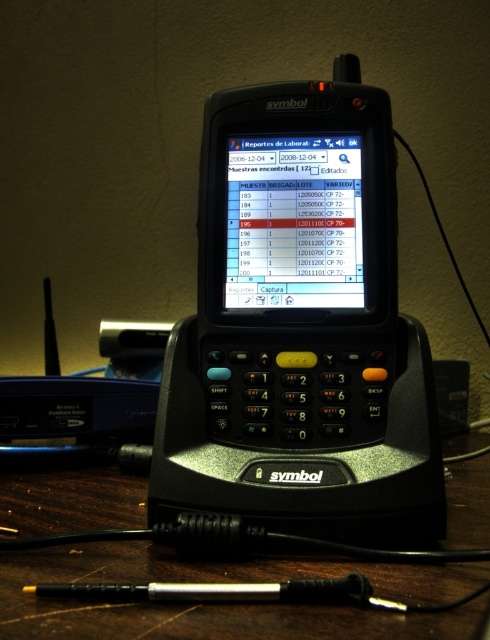
Looking at this image, you are an inventory manager in a laboratory. You need to access the Symbol mobile computer to check the sample reports. The device is docked on a table. Based on the image, where is the black plastic phone at center located relative to the black plastic table at center?

The black plastic phone at center is to the left of the black plastic table at center according to the description.